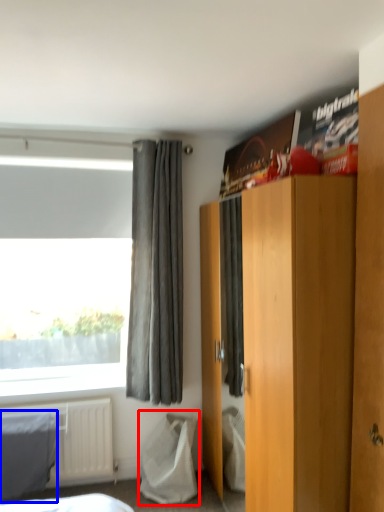
Question: Which point is closer to the camera, sheet (highlighted by a red box) or blanket (highlighted by a blue box)?

Choices:
 (A) sheet
 (B) blanket

Answer: (B)